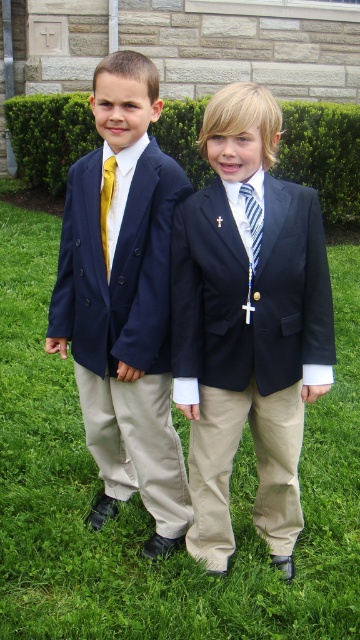
You are a photographer setting up for a group photo. You need to position the matte black suit at center so it aligns with the golden ratio point at coordinates (x=248, y=326). Where should you place the matte black suit at center in the frame?

The point at coordinates (x=248, y=326) is already marked as the location for the matte black suit at center, so you should position the matte black suit at center exactly at that golden ratio point.

You are a photographer taking a picture of the two boys. You want to ensure the gold silk tie at left and the green grass at center are both in focus. Which object should you focus on first to make sure both are sharp?

The green grass at center is below the gold silk tie at left, so you should focus on the gold silk tie at left first to ensure both are in focus.

You are a photographer setting up for a group photo. You need to ensure that the matte black suit at center and the striped fabric tie at center are both visible in the frame. Based on their positions, which one should you focus on first to ensure both are in focus?

The matte black suit at center is in front of the striped fabric tie at center, so you should focus on the matte black suit at center first to ensure both are in focus.